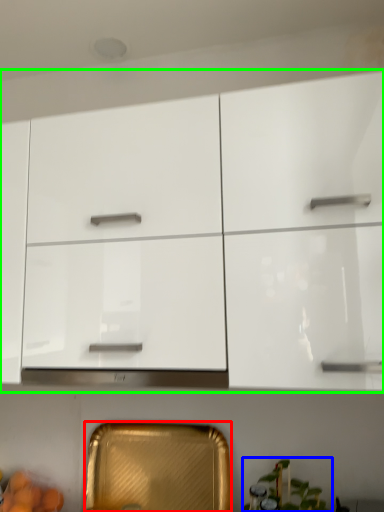
Question: Which object is positioned closest to cabinetry (highlighted by a red box)? Select from plant (highlighted by a blue box) and cabinetry (highlighted by a green box).

Choices:
 (A) plant
 (B) cabinetry

Answer: (A)